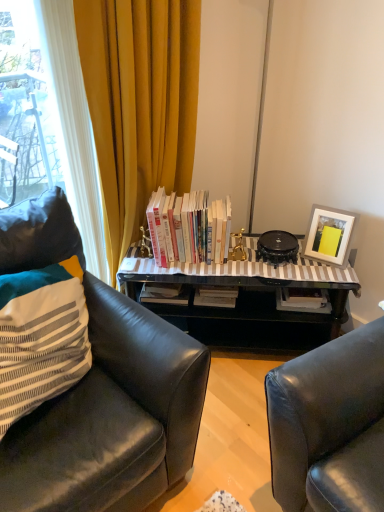
Question: Is white paperbacks at center spatially inside striped fabric pillow at left, or outside of it?

Choices:
 (A) inside
 (B) outside

Answer: (B)

Question: Looking at their shapes, would you say white paperbacks at center is wider or thinner than striped fabric pillow at left?

Choices:
 (A) thin
 (B) wide

Answer: (A)

Question: Estimate the real-world distances between objects in this image. Which object is closer to the black glass table at center?

Choices:
 (A) black leather chair at left
 (B) striped fabric pillow at left
 (C) white matte picture frame at upper right
 (D) white paperbacks at center

Answer: (D)

Question: Which object is the closest to the white matte picture frame at upper right?

Choices:
 (A) white paperbacks at center
 (B) striped fabric pillow at left
 (C) black leather chair at left
 (D) black glass table at center

Answer: (D)